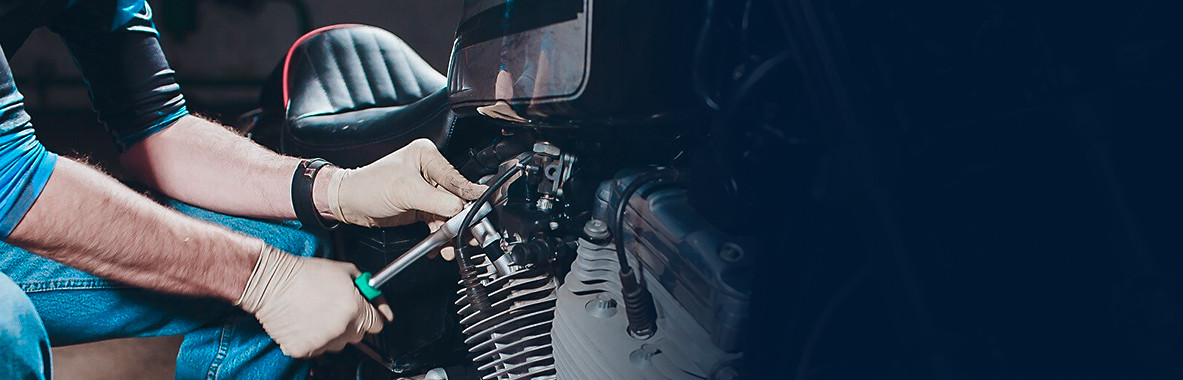
Locate an element on the screen. Image resolution: width=1183 pixels, height=380 pixels. socket is located at coordinates (446, 224).